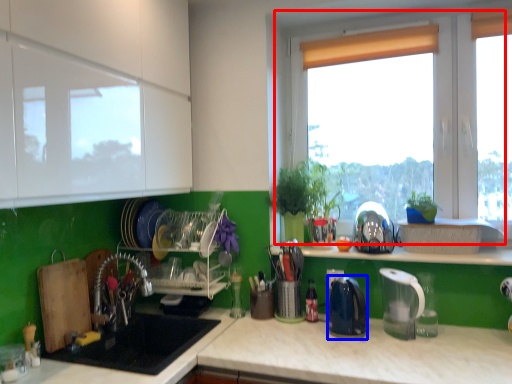
Question: Which object appears closest to the camera in this image, window (highlighted by a red box) or kitchen appliance (highlighted by a blue box)?

Choices:
 (A) window
 (B) kitchen appliance

Answer: (B)